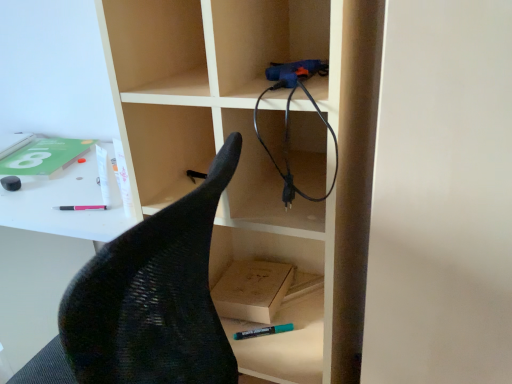
The height and width of the screenshot is (384, 512). Identify the location of free space to the back side of matte black eraser at left, the 1th stationery viewed from the left. (39, 165).